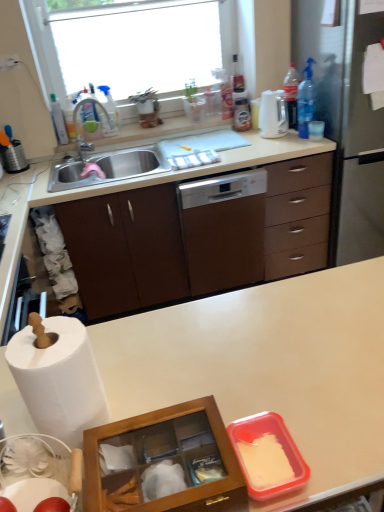
The height and width of the screenshot is (512, 384). I want to click on vacant space behind white paper at left, so click(128, 352).